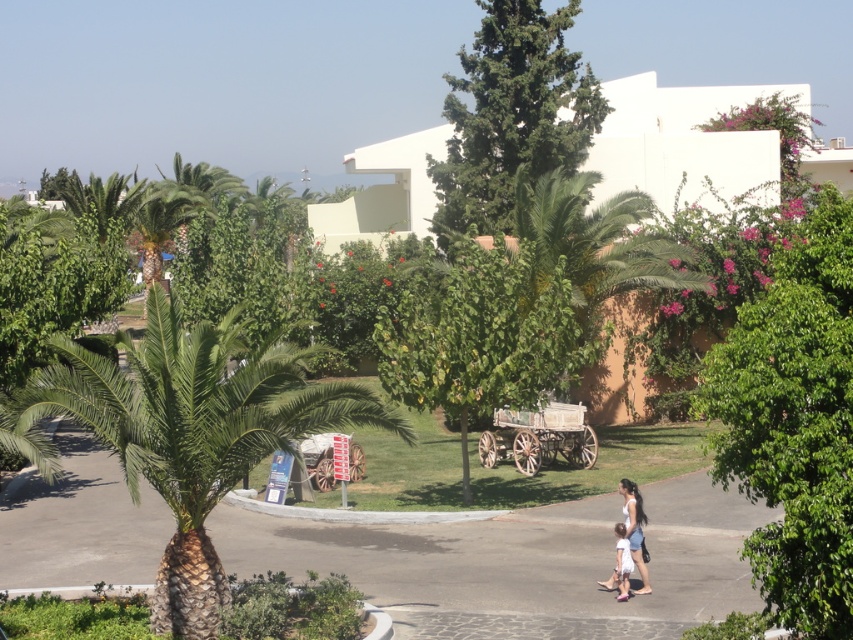
You are standing in the outdoor scene and want to take a photo of the white cotton dress at lower right without the green leafy palm at center appearing in the frame. Which direction should you move to achieve this?

Move to the right so that the white cotton dress at lower right is positioned away from the green leafy palm at center, which is to the left of it.

From the picture: You are standing in the outdoor scene and want to take a photo of both the green leafy tree at center and the green leafy tree at upper center. Which tree should you focus on first to ensure both are in the frame?

You should focus on the green leafy tree at upper center first because it is farther away from you than the green leafy tree at center, so adjusting the camera to include both would require starting with the one further back.